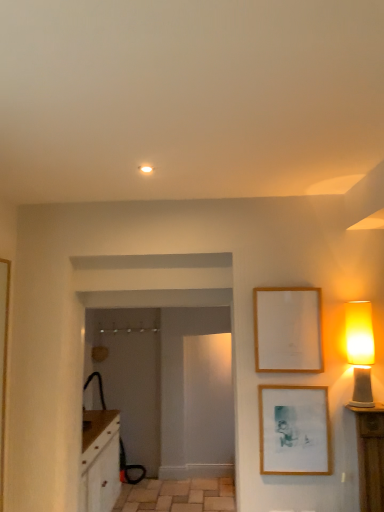
Question: Is wooden picture frame at upper right, the first picture frame in the top-to-bottom sequence, closer to the viewer compared to natural stone tile at lower center?

Choices:
 (A) yes
 (B) no

Answer: (A)

Question: Is the depth of wooden picture frame at upper right, the first picture frame in the top-to-bottom sequence, greater than that of natural stone tile at lower center?

Choices:
 (A) no
 (B) yes

Answer: (A)

Question: Can you confirm if wooden picture frame at upper right, the first picture frame in the top-to-bottom sequence, is positioned to the right of natural stone tile at lower center?

Choices:
 (A) yes
 (B) no

Answer: (A)

Question: Is wooden picture frame at upper right, which ranks as the second picture frame in bottom-to-top order, smaller than natural stone tile at lower center?

Choices:
 (A) no
 (B) yes

Answer: (B)

Question: Is wooden picture frame at upper right, which ranks as the second picture frame in bottom-to-top order, beside natural stone tile at lower center?

Choices:
 (A) yes
 (B) no

Answer: (B)

Question: Would you say wooden picture frame at upper right, the first picture frame in the top-to-bottom sequence, is outside natural stone tile at lower center?

Choices:
 (A) no
 (B) yes

Answer: (B)

Question: Is matte wooden picture frame at lower right, the second picture frame when ordered from top to bottom, to the left of matte yellow glass lampshade at right from the viewer's perspective?

Choices:
 (A) no
 (B) yes

Answer: (B)

Question: From the image's perspective, is matte wooden picture frame at lower right, the second picture frame when ordered from top to bottom, beneath matte yellow glass lampshade at right?

Choices:
 (A) no
 (B) yes

Answer: (B)

Question: Does matte wooden picture frame at lower right, positioned as the 1th picture frame in bottom-to-top order, appear on the right side of matte yellow glass lampshade at right?

Choices:
 (A) yes
 (B) no

Answer: (B)

Question: From a real-world perspective, does matte wooden picture frame at lower right, the second picture frame when ordered from top to bottom, stand above matte yellow glass lampshade at right?

Choices:
 (A) no
 (B) yes

Answer: (A)

Question: From a real-world perspective, is matte wooden picture frame at lower right, the second picture frame when ordered from top to bottom, physically below matte yellow glass lampshade at right?

Choices:
 (A) no
 (B) yes

Answer: (B)

Question: Is matte wooden picture frame at lower right, the second picture frame when ordered from top to bottom, outside matte yellow glass lampshade at right?

Choices:
 (A) yes
 (B) no

Answer: (A)

Question: Is matte wooden picture frame at lower right, the second picture frame when ordered from top to bottom, closer to camera compared to wooden picture frame at upper right, which ranks as the second picture frame in bottom-to-top order?

Choices:
 (A) yes
 (B) no

Answer: (A)